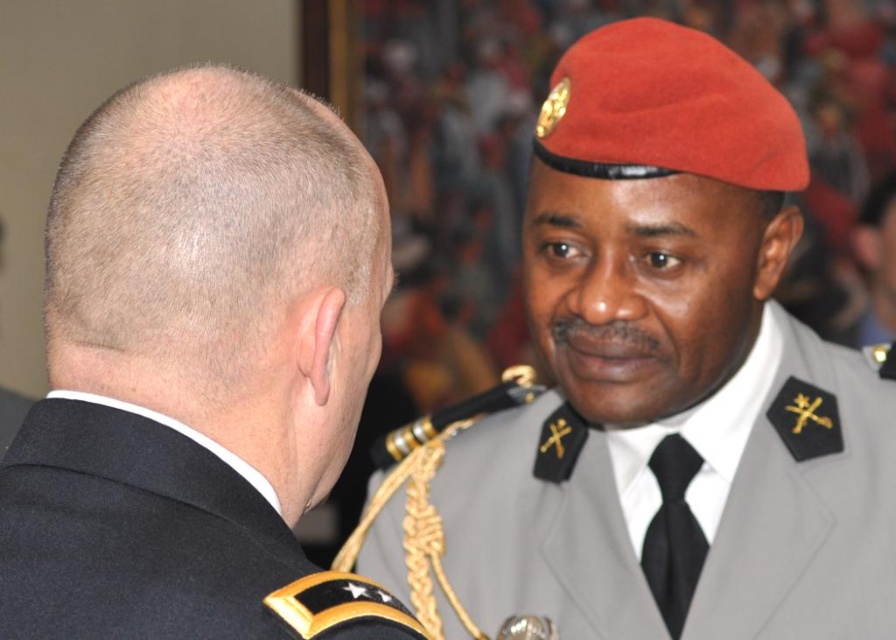
You are a photographer at a military ceremony. You need to capture a photo where both the satin red beret at upper right and the black wool military uniform at upper left are visible. Based on their positions, which object is closer to the right edge of the photo?

The satin red beret at upper right is to the right of the black wool military uniform at upper left, so it is closer to the right edge of the photo.

You are a photographer at a military ceremony. You need to capture a photo of the black matte uniform at left and the satin red beret at upper right. Which object should you focus on first if you want to follow the standard left to right composition rule?

You should focus on the black matte uniform at left first, as it is positioned to the left of the satin red beret at upper right, following the left to right composition rule.

You are a photographer at a military ceremony. You need to capture a clear shot of the satin red beret at upper right and the black matte uniform at left. Based on their positions, which object is covering part of the other?

The satin red beret at upper right is positioned over the black matte uniform at left, so it is covering part of the black matte uniform at left.